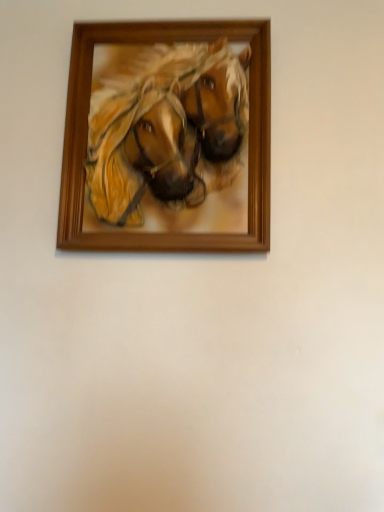
What do you see at coordinates (169, 136) in the screenshot?
I see `shiny brown horse at center` at bounding box center [169, 136].

Based on the photo, what is the approximate height of shiny brown horse at center?

The height of shiny brown horse at center is 64.76 centimeters.

Identify the location of shiny brown horse at center. The width and height of the screenshot is (384, 512). (169, 136).

Where is `shiny brown horse at center`? The width and height of the screenshot is (384, 512). shiny brown horse at center is located at coordinates (169, 136).